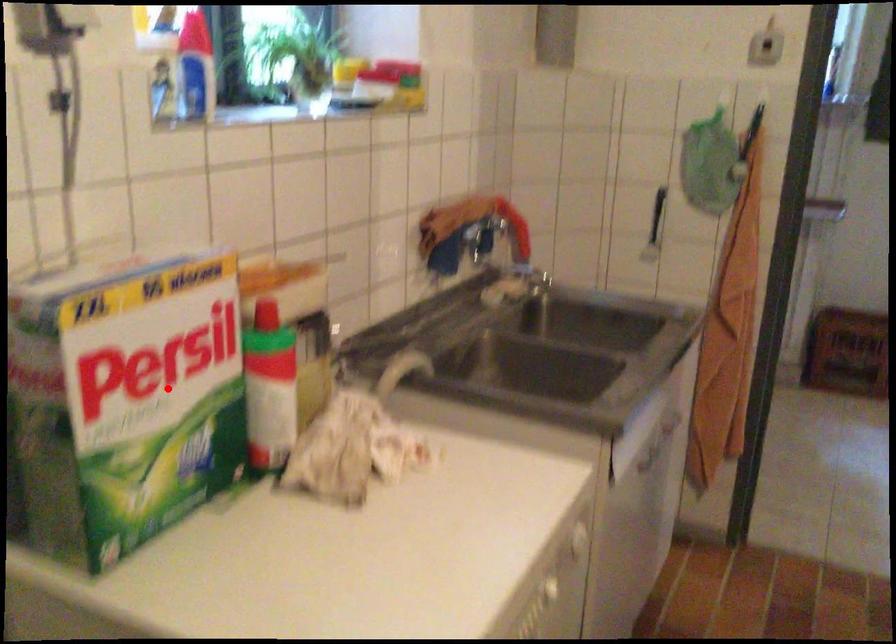
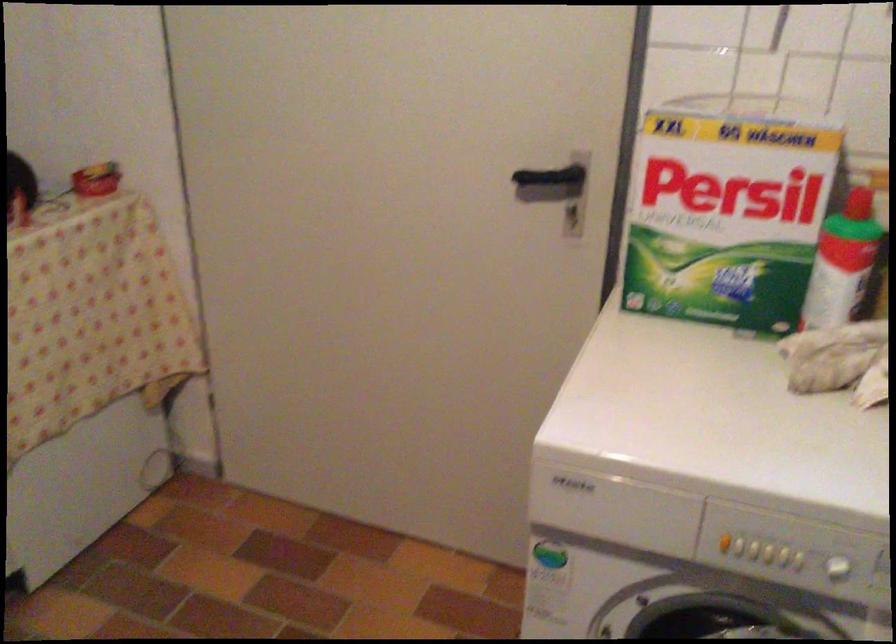
Where in the second image is the point corresponding to the highlighted location from the first image?

(728, 210)